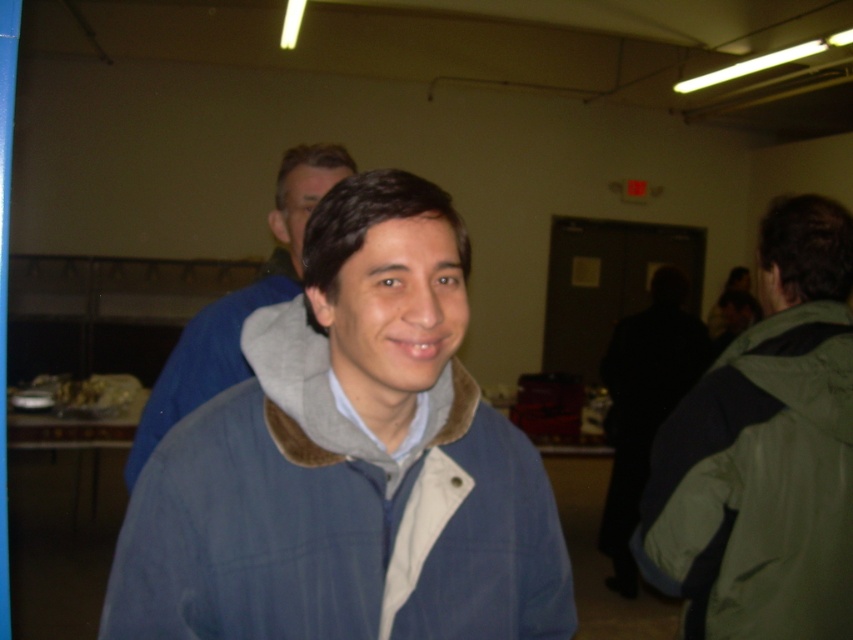
You are at a party and want to find the blue corduroy jacket at center and the blue fleece jacket at center. If you are facing the jackets, which one is on your left?

The blue fleece jacket at center is on your left because the blue corduroy jacket at center is to the right of it.

You are organizing a coat check for an event and have two jackets to hang. The green matte jacket at right and the blue fleece jacket at center. Which jacket requires a wider hanger?

The blue fleece jacket at center requires a wider hanger because it is thicker than the green matte jacket at right.